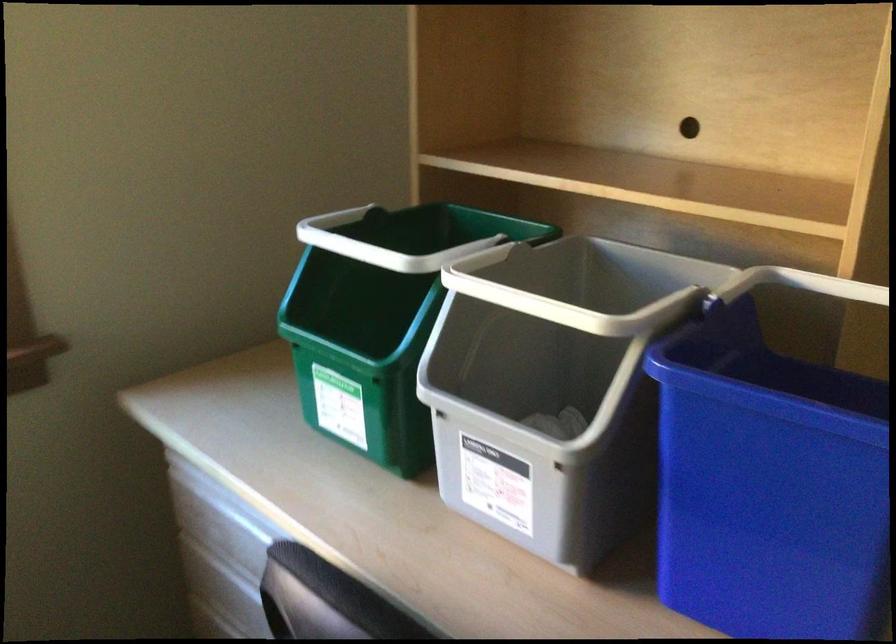
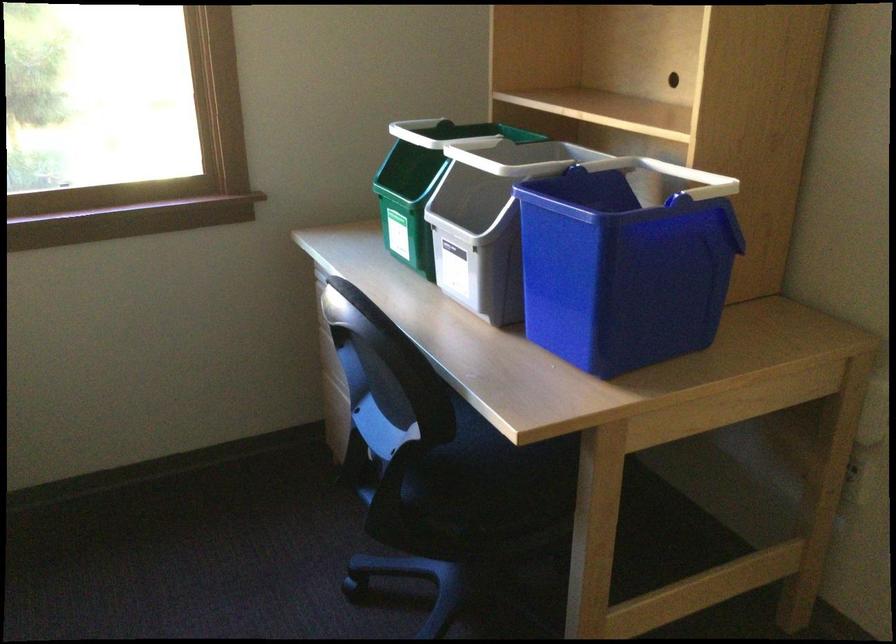
In the second image, find the point that corresponds to (x=493, y=348) in the first image.

(479, 201)